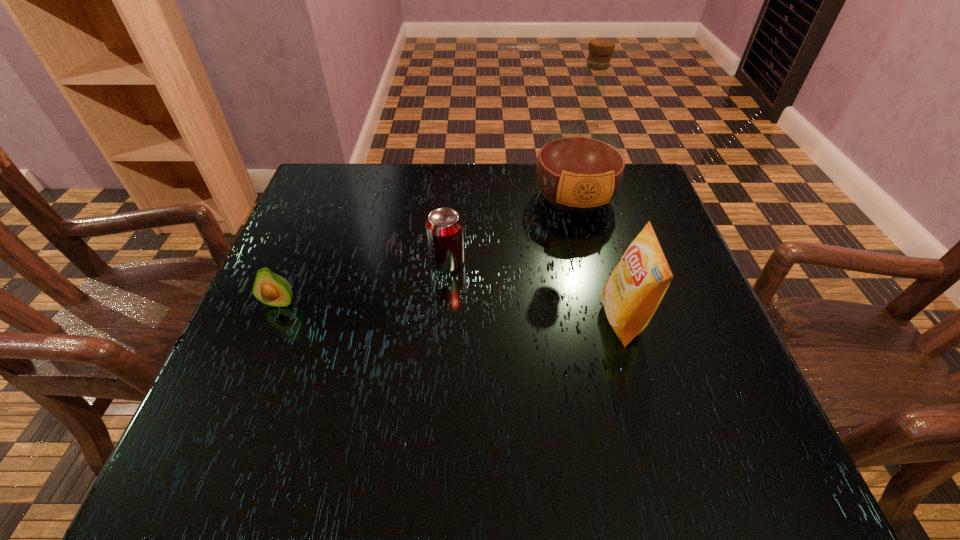
What are the coordinates of `free space located on the front-facing side of the third shortest object` in the screenshot? It's located at (489, 319).

This screenshot has height=540, width=960. What are the coordinates of `free spot located on the front of the third object from right to left` in the screenshot? It's located at (438, 378).

Locate an element on the screen. free space located on the cut side of the avocado is located at coordinates (230, 422).

The width and height of the screenshot is (960, 540). In order to click on object situated at the far edge in this screenshot , I will do `click(580, 168)`.

In order to click on object that is at the left edge in this screenshot , I will do `click(269, 288)`.

This screenshot has width=960, height=540. In order to click on liquor that is positioned at the right edge in this screenshot , I will do `click(580, 168)`.

Where is `crisp (potato chip) situated at the right edge`? The image size is (960, 540). crisp (potato chip) situated at the right edge is located at coordinates (631, 295).

This screenshot has width=960, height=540. I want to click on object located in the far right corner section of the desktop, so click(x=580, y=168).

In the image, there is a desktop. Identify the location of vacant space at the far edge. The width and height of the screenshot is (960, 540). (490, 204).

This screenshot has height=540, width=960. Identify the location of free space at the near edge. (348, 460).